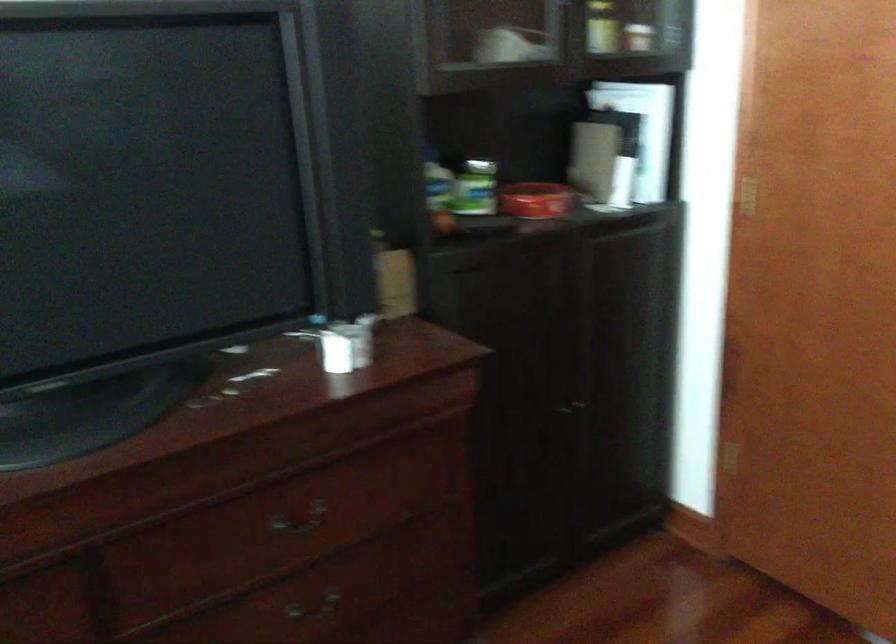
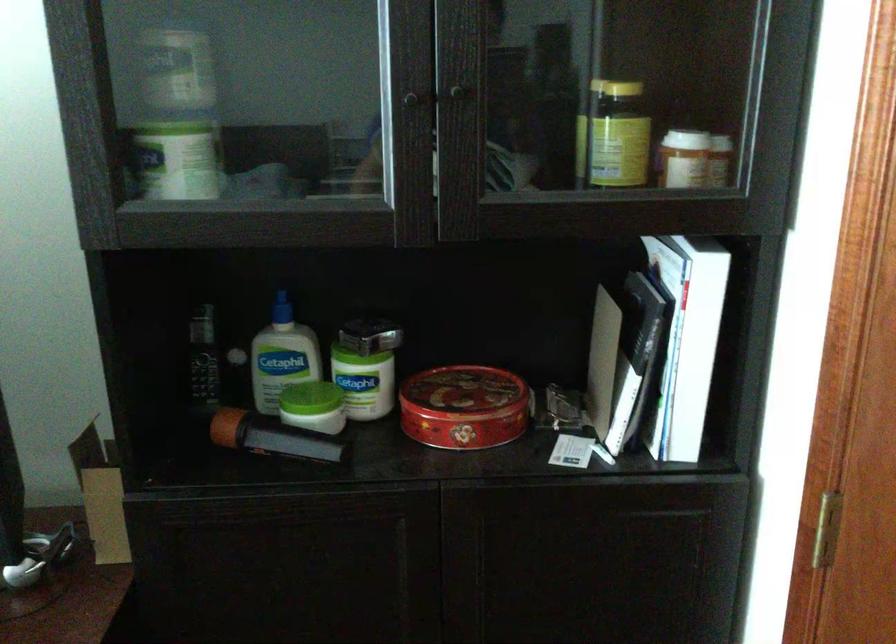
Locate, in the second image, the point that corresponds to pixel 675 249 in the first image.

(707, 554)